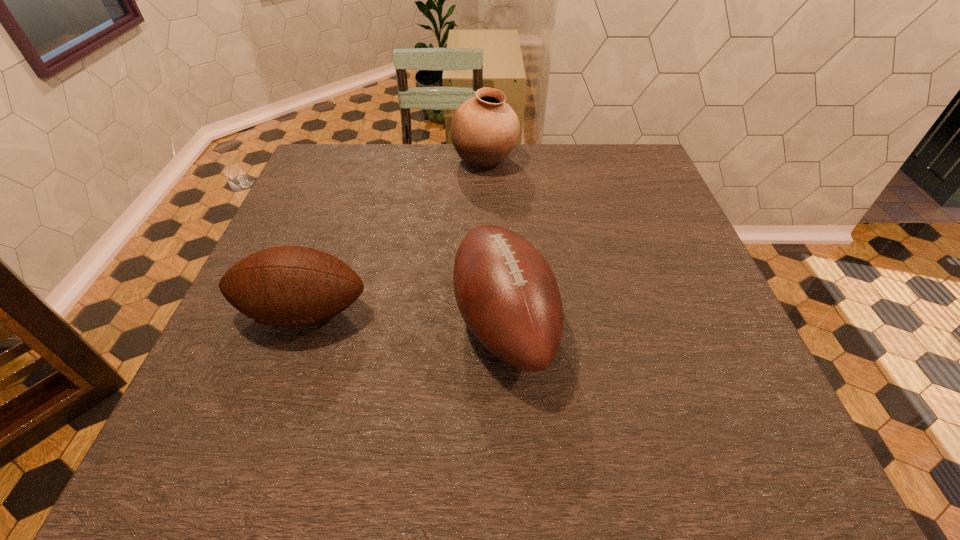
Identify the location of the farthest object. (484, 130).

Locate an element on the screen. This screenshot has height=540, width=960. the right football is located at coordinates (506, 292).

Image resolution: width=960 pixels, height=540 pixels. In order to click on the left football in this screenshot , I will do `click(281, 286)`.

Find the location of a particular element. the leftmost object is located at coordinates (281, 286).

What are the coordinates of `vacant space located on the front of the pottery` in the screenshot? It's located at (486, 214).

Image resolution: width=960 pixels, height=540 pixels. Identify the location of vacant area situated on the back of the taller football. (497, 183).

Locate an element on the screen. Image resolution: width=960 pixels, height=540 pixels. free space located on the laces of the shorter football is located at coordinates (x=276, y=390).

This screenshot has width=960, height=540. Find the location of `object situated at the far edge`. object situated at the far edge is located at coordinates (484, 130).

At what (x,y) coordinates should I click in order to perform the action: click on object that is at the left edge. Please return your answer as a coordinate pair (x, y). This screenshot has height=540, width=960. Looking at the image, I should click on (281, 286).

Locate an element on the screen. vacant space at the far edge of the desktop is located at coordinates (426, 178).